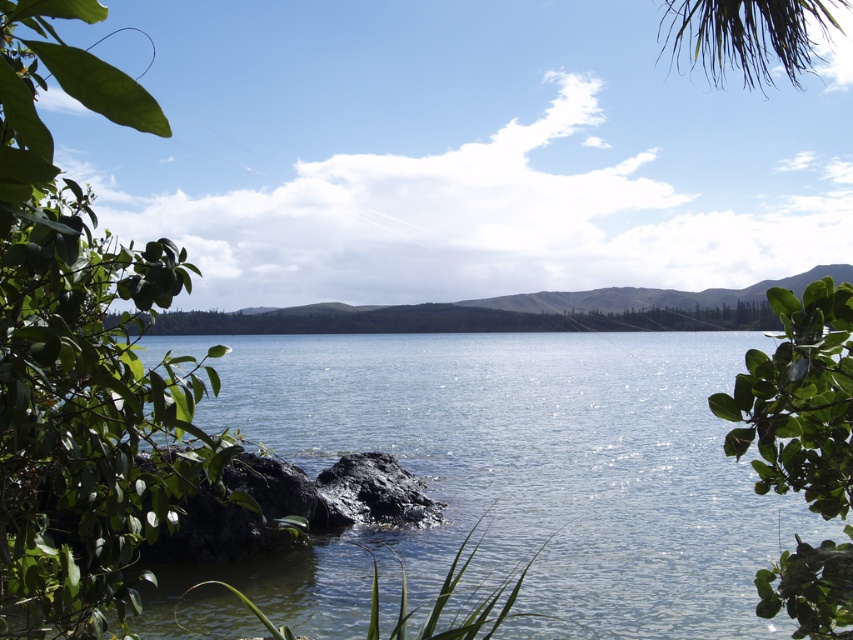
Can you confirm if clear water at center is wider than green leafy tree at center?

Correct, the width of clear water at center exceeds that of green leafy tree at center.

Based on the photo, can you confirm if clear water at center is thinner than green leafy tree at center?

No.

I want to click on clear water at center, so click(x=538, y=464).

What do you see at coordinates (82, 358) in the screenshot?
I see `green leafy tree at left` at bounding box center [82, 358].

Which is above, green leafy tree at left or green leafy tree at center?

green leafy tree at left is higher up.

At what (x,y) coordinates should I click in order to perform the action: click on green leafy tree at left. Please return your answer as a coordinate pair (x, y). Image resolution: width=853 pixels, height=640 pixels. Looking at the image, I should click on (82, 358).

Which is above, clear water at center or green leafy tree at left?

green leafy tree at left is above.

Is point (433, 572) positioned after point (155, 294)?

Yes, it is.

Who is more distant from viewer, (x=339, y=596) or (x=4, y=58)?

Positioned behind is point (x=339, y=596).

You are a GUI agent. You are given a task and a screenshot of the screen. Output one action in this format:
    pyautogui.click(x=<x>, y=<y>)
    Task: Click on the clear water at center
    
    Given the screenshot: What is the action you would take?
    pyautogui.click(x=538, y=464)